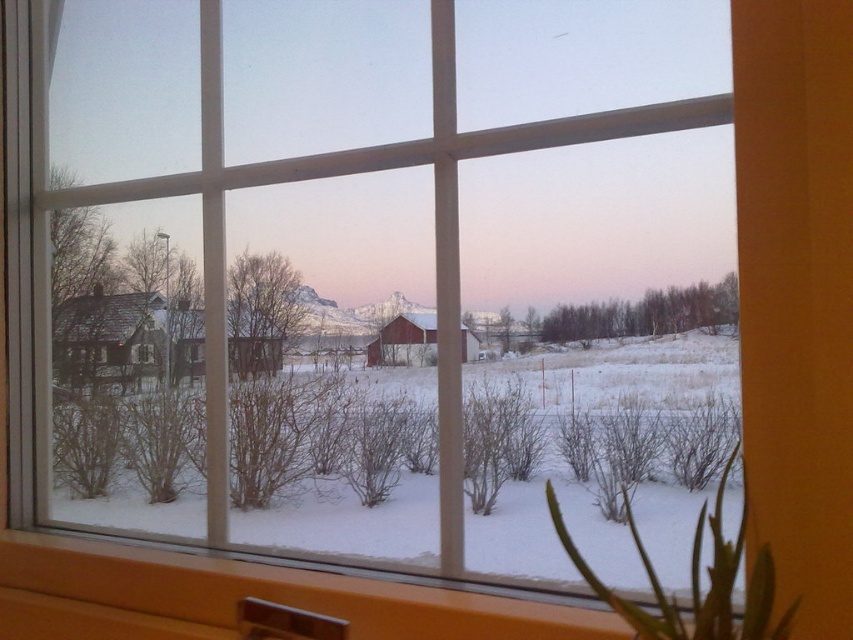
You are looking through the window at the winter scene. There is a white fluffy snow at center and a green leafy plant at lower right. Which object is positioned to the left of the other?

The white fluffy snow at center is to the left of the green leafy plant at lower right.

You are standing in a room looking through the window. You see the white fluffy snow at center and the green leafy plant at lower right. Which object is closer to you?

The white fluffy snow at center is closer to you since it is further to the viewer than the green leafy plant at lower right.

You are standing in a room with a window divided into six panes. You notice a point marked at coordinates (x=596, y=456). Based on the window layout, can you determine what is located at that specific coordinate on the window pane?

The point at (x=596, y=456) on the window pane corresponds to white fluffy snow at center, which is visible through the window.